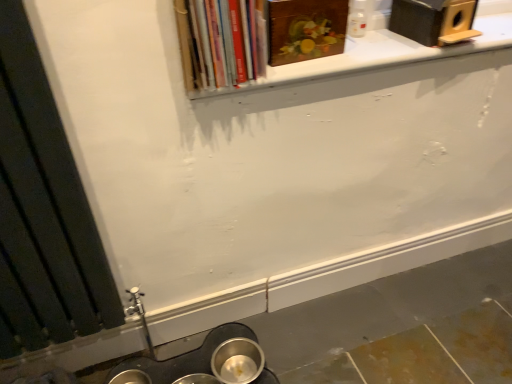
Question: Is white matte window sill at upper center to the left of black matte radiator at left from the viewer's perspective?

Choices:
 (A) no
 (B) yes

Answer: (A)

Question: Is white matte window sill at upper center outside of black matte radiator at left?

Choices:
 (A) yes
 (B) no

Answer: (A)

Question: Does white matte window sill at upper center have a smaller size compared to black matte radiator at left?

Choices:
 (A) no
 (B) yes

Answer: (B)

Question: Is white matte window sill at upper center positioned behind black matte radiator at left?

Choices:
 (A) no
 (B) yes

Answer: (B)

Question: Does white matte window sill at upper center come in front of black matte radiator at left?

Choices:
 (A) yes
 (B) no

Answer: (B)

Question: Is white matte window sill at upper center in front of or behind wooden painting at upper center, the 2th book viewed from the left, in the image?

Choices:
 (A) front
 (B) behind

Answer: (A)

Question: Considering the positions of white matte window sill at upper center and wooden painting at upper center, the 2th book viewed from the left, in the image, is white matte window sill at upper center wider or thinner than wooden painting at upper center, the 2th book viewed from the left,?

Choices:
 (A) wide
 (B) thin

Answer: (A)

Question: From a real-world perspective, relative to wooden painting at upper center, which is the 1th book from right to left, is white matte window sill at upper center vertically above or below?

Choices:
 (A) above
 (B) below

Answer: (B)

Question: From their relative heights in the image, would you say white matte window sill at upper center is taller or shorter than wooden painting at upper center, the 2th book viewed from the left?

Choices:
 (A) short
 (B) tall

Answer: (A)

Question: Looking at the image, does hardcover books at upper center, which appears as the second book when viewed from the right, seem bigger or smaller compared to wooden painting at upper center, the 2th book viewed from the left?

Choices:
 (A) small
 (B) big

Answer: (B)

Question: From a real-world perspective, relative to wooden painting at upper center, which is the 1th book from right to left, is hardcover books at upper center, which appears as the second book when viewed from the right, vertically above or below?

Choices:
 (A) below
 (B) above

Answer: (B)

Question: From their relative heights in the image, would you say hardcover books at upper center, which is counted as the 1th book, starting from the left, is taller or shorter than wooden painting at upper center, the 2th book viewed from the left?

Choices:
 (A) tall
 (B) short

Answer: (A)

Question: In the image, is hardcover books at upper center, which appears as the second book when viewed from the right, positioned in front of or behind wooden painting at upper center, which is the 1th book from right to left?

Choices:
 (A) front
 (B) behind

Answer: (A)

Question: Is black matte radiator at left inside or outside of wooden painting at upper center, the 2th book viewed from the left?

Choices:
 (A) outside
 (B) inside

Answer: (A)

Question: Is black matte radiator at left to the left or to the right of wooden painting at upper center, the 2th book viewed from the left, in the image?

Choices:
 (A) right
 (B) left

Answer: (B)